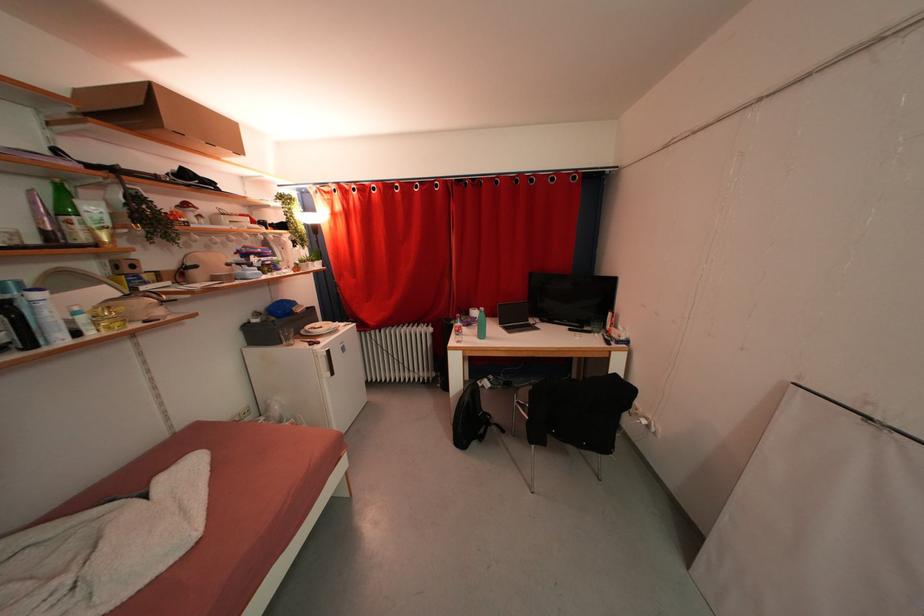
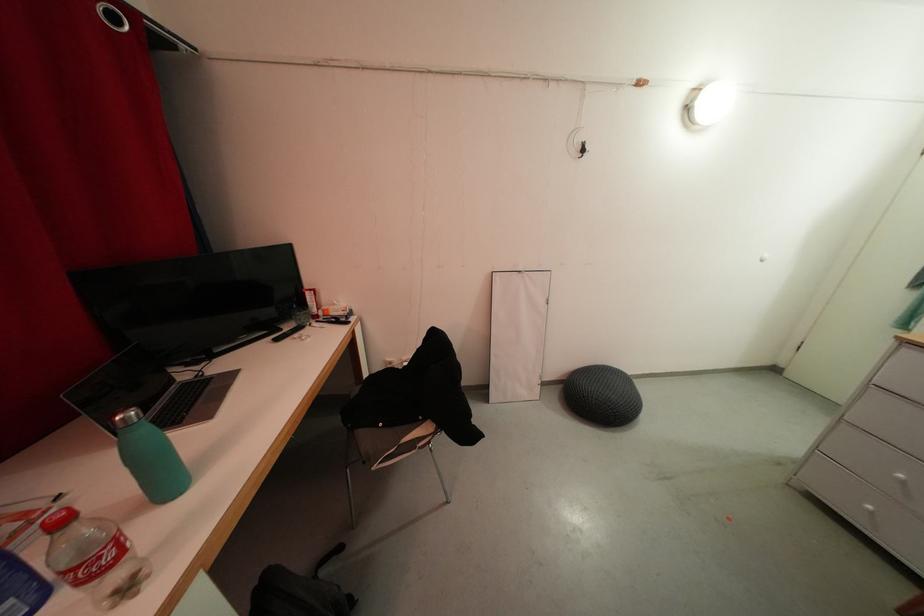
Find the pixel in the second image that matches pixel 489 442 in the first image.

(357, 601)